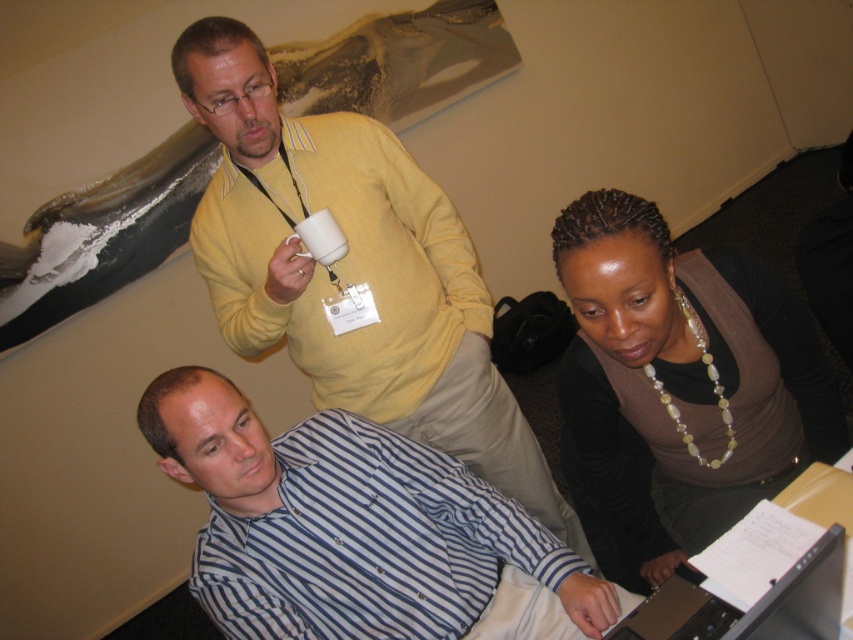
Based on the photo, which of these two, brown matte sweater at lower right or silver metallic laptop at lower right, stands shorter?

silver metallic laptop at lower right

Is point (654, 403) positioned behind point (695, 628)?

Yes.

Locate an element on the screen. This screenshot has width=853, height=640. brown matte sweater at lower right is located at coordinates (677, 387).

The height and width of the screenshot is (640, 853). What do you see at coordinates (352, 269) in the screenshot? I see `yellow sweater at upper center` at bounding box center [352, 269].

Does yellow sweater at upper center have a smaller size compared to silver metallic laptop at lower right?

Actually, yellow sweater at upper center might be larger than silver metallic laptop at lower right.

Is point (415, 212) positioned before point (798, 577)?

No, it is behind (798, 577).

I want to click on yellow sweater at upper center, so click(x=352, y=269).

Does silver metallic laptop at lower right appear on the left side of white matte mug at upper center?

No, silver metallic laptop at lower right is not to the left of white matte mug at upper center.

Can you confirm if silver metallic laptop at lower right is positioned above white matte mug at upper center?

Actually, silver metallic laptop at lower right is below white matte mug at upper center.

Where is `silver metallic laptop at lower right`? This screenshot has height=640, width=853. silver metallic laptop at lower right is located at coordinates 751,605.

Locate an element on the screen. The width and height of the screenshot is (853, 640). silver metallic laptop at lower right is located at coordinates (751, 605).